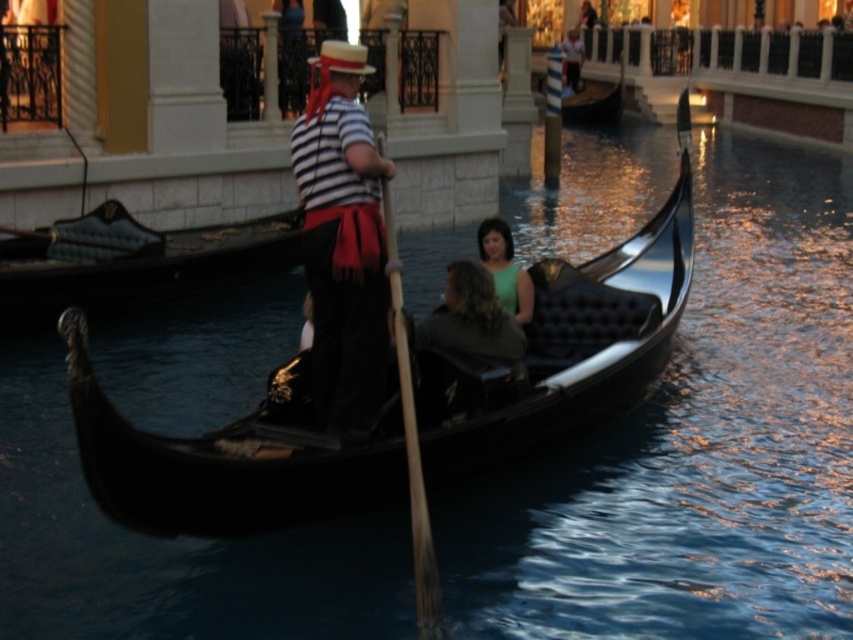
Question: Can you confirm if black polished wood gondola at center is positioned above black glossy gondola at center?

Choices:
 (A) no
 (B) yes

Answer: (A)

Question: Which point is farther to the camera?

Choices:
 (A) (206, 477)
 (B) (529, 292)
 (C) (541, 81)
 (D) (27, 237)

Answer: (C)

Question: Is the position of striped fabric shirt at center more distant than that of black glossy gondola at center?

Choices:
 (A) no
 (B) yes

Answer: (A)

Question: Which point appears farthest from the camera in this image?

Choices:
 (A) click(258, 452)
 (B) click(569, 108)
 (C) click(254, 248)
 (D) click(485, 243)

Answer: (B)

Question: Does striped fabric shirt at center lie in front of green matte dress at center?

Choices:
 (A) yes
 (B) no

Answer: (A)

Question: Considering the real-world distances, which object is closest to the black polished wood gondola at center?

Choices:
 (A) black glossy gondola at center
 (B) green matte dress at center

Answer: (B)